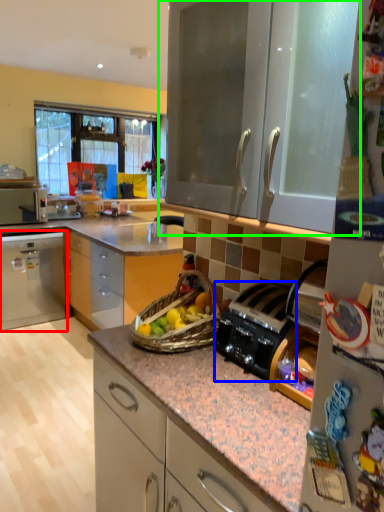
Question: Which object is positioned closest to cabinetry (highlighted by a red box)? Select from kitchen appliance (highlighted by a blue box) and cabinetry (highlighted by a green box).

Choices:
 (A) kitchen appliance
 (B) cabinetry

Answer: (B)